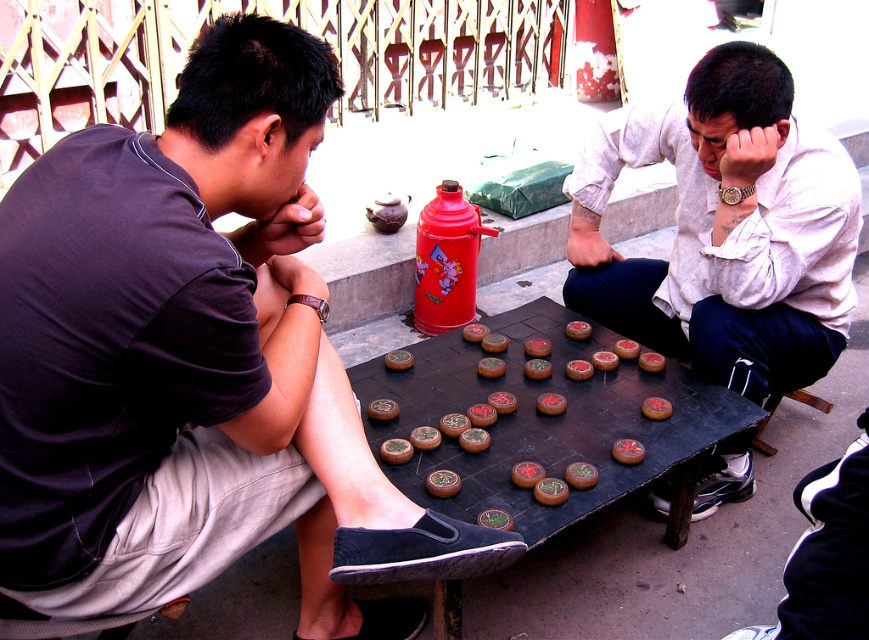
You are a photographer trying to capture a candid shot of the two players. You want to ensure that both the matte black shirt at left and the matte white shirt at center are clearly visible in your frame. Based on their positions, which player is positioned further to the left side of the scene?

The matte black shirt at left is positioned to the left of the matte white shirt at center, so the matte black shirt at left is further to the left side of the scene.

You are a photographer wanting to capture both the matte black shirt at left and the matte white shirt at center in a single frame. Since the camera can only focus on one subject at a time, which shirt should you prioritize focusing on to ensure the larger subject is sharp?

The matte black shirt at left is larger in size than the matte white shirt at center, so you should prioritize focusing on the matte black shirt at left to ensure the larger subject is sharp.